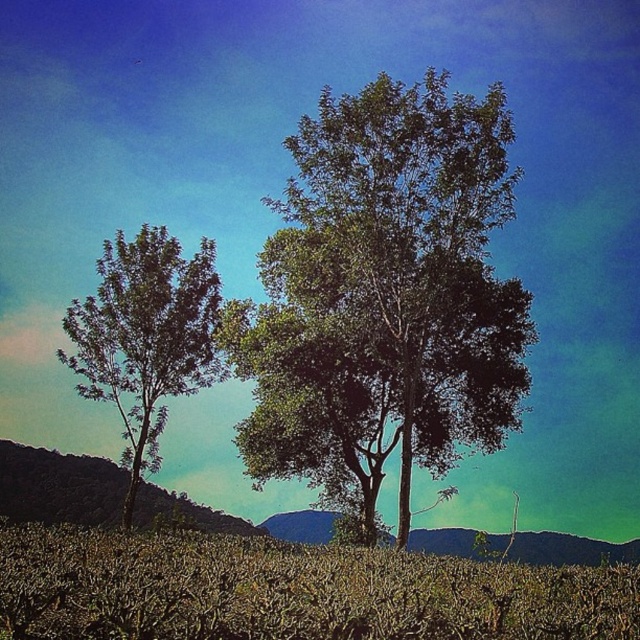
Question: Does green leafy tree at center appear on the left side of green leafy tree at left?

Choices:
 (A) no
 (B) yes

Answer: (A)

Question: Which object is the farthest from the green leafy tree at left?

Choices:
 (A) brown dry grass at lower center
 (B) green leafy tree at center

Answer: (A)

Question: Does green leafy tree at center have a larger size compared to dark green foliage at left?

Choices:
 (A) no
 (B) yes

Answer: (B)

Question: Is brown dry grass at lower center positioned in front of green leafy tree at left?

Choices:
 (A) yes
 (B) no

Answer: (A)

Question: Among these objects, which one is nearest to the camera?

Choices:
 (A) green leafy tree at left
 (B) green leafy tree at center
 (C) brown dry grass at lower center
 (D) dark green foliage at left

Answer: (C)

Question: Among these objects, which one is nearest to the camera?

Choices:
 (A) brown dry grass at lower center
 (B) green leafy tree at center

Answer: (A)